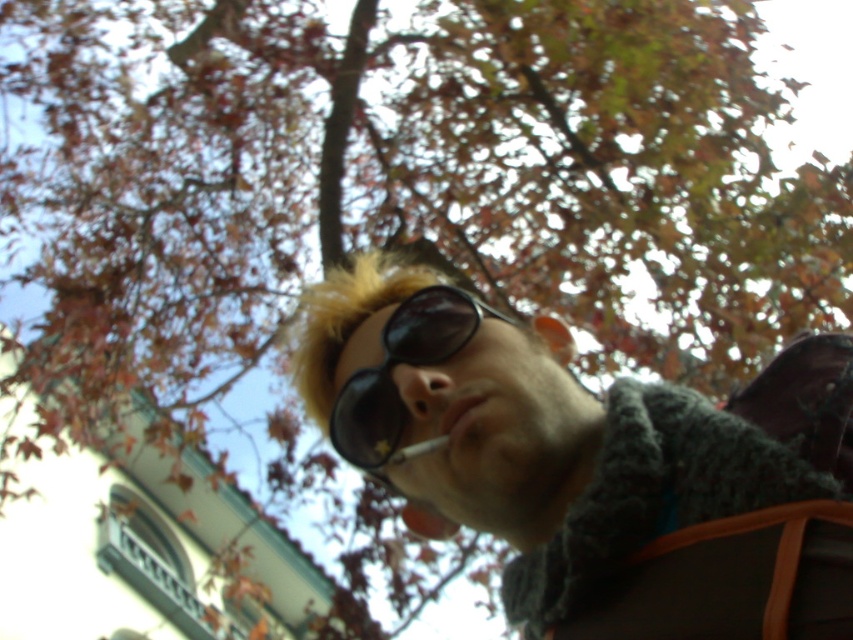
You are a photographer trying to capture the person in the scene. You notice the black matte sunglasses at center and the white matte cigarette at center. Which object is covering part of the other?

The black matte sunglasses at center is positioned over the white matte cigarette at center, so the sunglasses are covering part of the cigarette.

You are standing in front of a person holding a cigarette and looking up at the autumn trees. You want to hand them a pair of matte black sunglasses at center. Can you reach them without moving closer?

The matte black sunglasses at center is 1.42 meters away from viewer, so yes, you can reach them without moving closer as the distance is within arm reach.